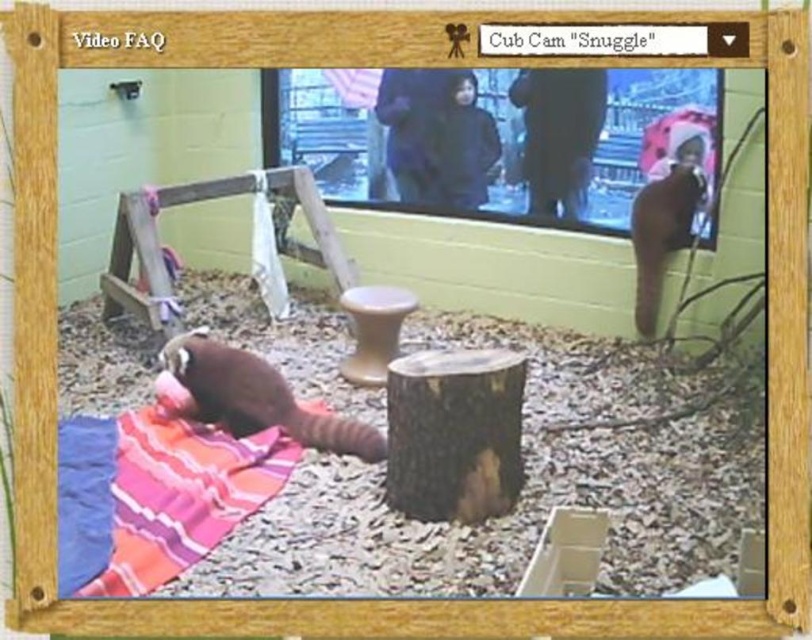
You are a zookeeper observing the Cub Cam Snuggle. You notice two points marked in the frame. The first point is at coordinate point(206, 468) and the second is at point(214, 404). Which point is closer to the camera?

Point(206, 468) is in front of point(214, 404), so it is closer to the camera.

You are a zookeeper checking the camera feed of the raccoon enclosure. You see the striped cotton blanket at lower left and the brown fuzzy animal at lower left. Which object is positioned higher up in the image?

The striped cotton blanket at lower left is taller than the brown fuzzy animal at lower left, so the striped cotton blanket at lower left is positioned higher up in the image.